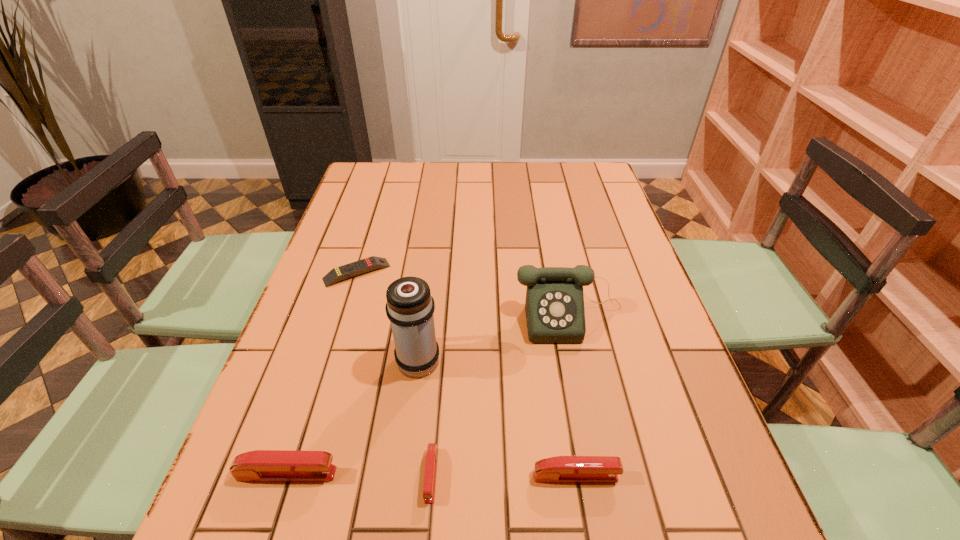
Find the location of a particular element. The height and width of the screenshot is (540, 960). free space at the far edge of the desktop is located at coordinates (472, 170).

The width and height of the screenshot is (960, 540). What are the coordinates of `free space at the near edge of the desktop` in the screenshot? It's located at (552, 442).

In the image, there is a desktop. What are the coordinates of `free region at the left edge` in the screenshot? It's located at (335, 233).

This screenshot has width=960, height=540. I want to click on vacant space at the right edge, so click(x=568, y=197).

Locate an element on the screen. This screenshot has width=960, height=540. vacant point at the far left corner is located at coordinates (355, 195).

Where is `vacant space at the far right corner of the desktop`? This screenshot has width=960, height=540. vacant space at the far right corner of the desktop is located at coordinates (573, 163).

Where is `unoccupied position between the farthest object and the rightmost stapler`? This screenshot has width=960, height=540. unoccupied position between the farthest object and the rightmost stapler is located at coordinates (467, 374).

You are a GUI agent. You are given a task and a screenshot of the screen. Output one action in this format:
    pyautogui.click(x=<x>, y=<y>)
    Task: Click on the free space that is in between the farthest object and the leftmost stapler
    This screenshot has height=540, width=960.
    Given the screenshot: What is the action you would take?
    point(322,373)

Locate an element on the screen. The height and width of the screenshot is (540, 960). vacant area that lies between the farthest object and the leftmost stapler is located at coordinates [322, 373].

Locate an element on the screen. This screenshot has width=960, height=540. free spot between the third shortest object and the tallest object is located at coordinates (497, 417).